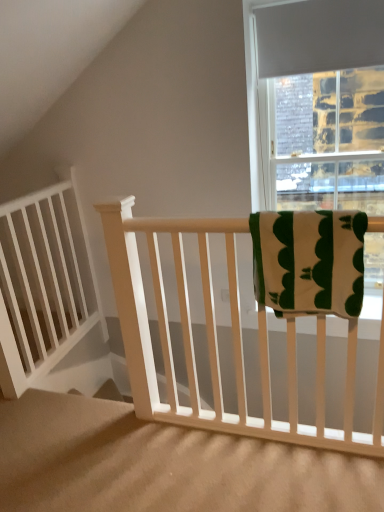
Question: Are white matte balustrade at left and white wood stairs at center located far from each other?

Choices:
 (A) no
 (B) yes

Answer: (A)

Question: Does white matte balustrade at left have a lesser width compared to white wood stairs at center?

Choices:
 (A) no
 (B) yes

Answer: (B)

Question: Is white matte balustrade at left facing away from white wood stairs at center?

Choices:
 (A) yes
 (B) no

Answer: (B)

Question: Does white matte balustrade at left have a greater height compared to white wood stairs at center?

Choices:
 (A) yes
 (B) no

Answer: (A)

Question: Is white matte balustrade at left bigger than white wood stairs at center?

Choices:
 (A) yes
 (B) no

Answer: (B)

Question: Choose the correct answer: Is white wood stairs at center inside white matte balustrade at left or outside it?

Choices:
 (A) outside
 (B) inside

Answer: (A)

Question: From a real-world perspective, is white wood stairs at center above or below white matte balustrade at left?

Choices:
 (A) below
 (B) above

Answer: (A)

Question: In terms of size, does white wood stairs at center appear bigger or smaller than white matte balustrade at left?

Choices:
 (A) big
 (B) small

Answer: (A)

Question: In terms of width, does white wood stairs at center look wider or thinner when compared to white matte balustrade at left?

Choices:
 (A) wide
 (B) thin

Answer: (A)

Question: From the image's perspective, relative to white wood stairs at center, is green cotton towel at upper right above or below?

Choices:
 (A) below
 (B) above

Answer: (B)

Question: Would you say green cotton towel at upper right is inside or outside white wood stairs at center?

Choices:
 (A) outside
 (B) inside

Answer: (A)

Question: In the image, is green cotton towel at upper right positioned in front of or behind white wood stairs at center?

Choices:
 (A) front
 (B) behind

Answer: (B)

Question: From their relative heights in the image, would you say green cotton towel at upper right is taller or shorter than white wood stairs at center?

Choices:
 (A) tall
 (B) short

Answer: (A)

Question: Considering the positions of point (21, 224) and point (327, 228), is point (21, 224) closer or farther from the camera than point (327, 228)?

Choices:
 (A) closer
 (B) farther

Answer: (B)

Question: Is white matte balustrade at left spatially inside green cotton towel at upper right, or outside of it?

Choices:
 (A) outside
 (B) inside

Answer: (A)